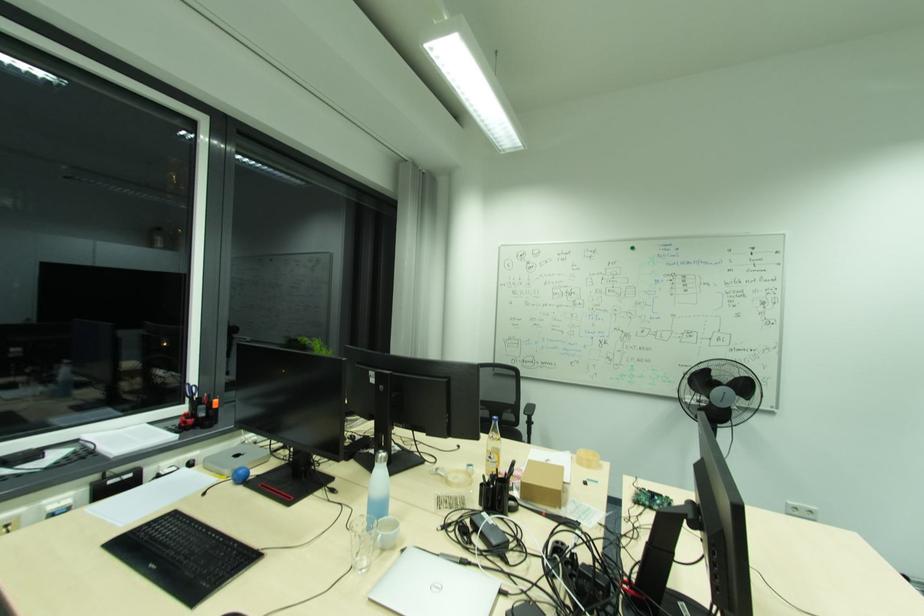
What do you see at coordinates (529, 408) in the screenshot? Image resolution: width=924 pixels, height=616 pixels. I see `a chair armrest` at bounding box center [529, 408].